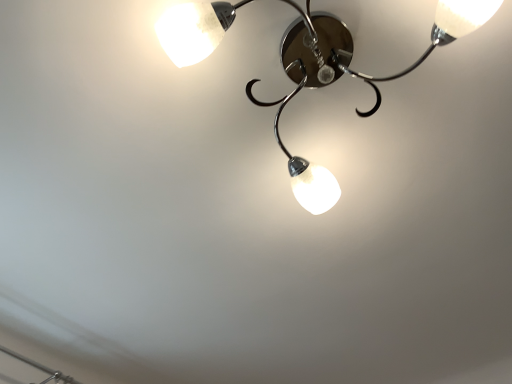
You are a GUI agent. You are given a task and a screenshot of the screen. Output one action in this format:
    pyautogui.click(x=<x>, y=<y>)
    Task: Click on the matte glass chandelier at upper center
    
    Given the screenshot: What is the action you would take?
    pyautogui.click(x=352, y=75)

The image size is (512, 384). What do you see at coordinates (352, 75) in the screenshot? I see `matte glass chandelier at upper center` at bounding box center [352, 75].

The image size is (512, 384). In order to click on matte glass chandelier at upper center in this screenshot , I will do `click(352, 75)`.